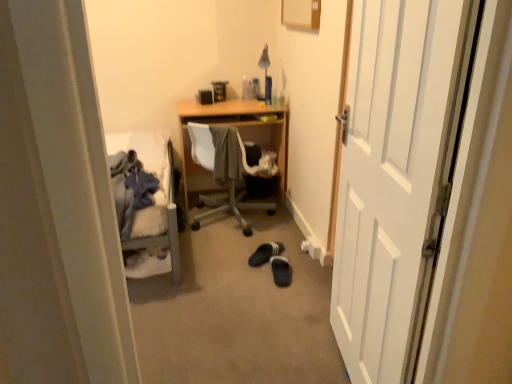
Question: Choose the correct answer: Is white wooden door at right inside black suede slippers at center floor, arranged as the 1th footwear when viewed from the front, or outside it?

Choices:
 (A) inside
 (B) outside

Answer: (B)

Question: Does point (365, 332) appear closer or farther from the camera than point (275, 269)?

Choices:
 (A) closer
 (B) farther

Answer: (A)

Question: Which of these objects is positioned closest to the white wooden door at right?

Choices:
 (A) black suede slippers at center floor, arranged as the 1th footwear when viewed from the front
 (B) denim jacket at left, the second clothing when ordered from back to front
 (C) black suede slippers at center, the first footwear in the back-to-front sequence
 (D) wooden chair at center
 (E) gray fabric at center, which is counted as the 2th clothing, starting from the front

Answer: (A)

Question: Which object is the farthest from the black suede slippers at center, positioned as the second footwear in front-to-back order?

Choices:
 (A) gray fabric at center, which is the 1th clothing in back-to-front order
 (B) black suede slippers at center floor, positioned as the second footwear in back-to-front order
 (C) denim jacket at left, marked as the 1th clothing in a front-to-back arrangement
 (D) white wooden door at right
 (E) wooden chair at center

Answer: (D)